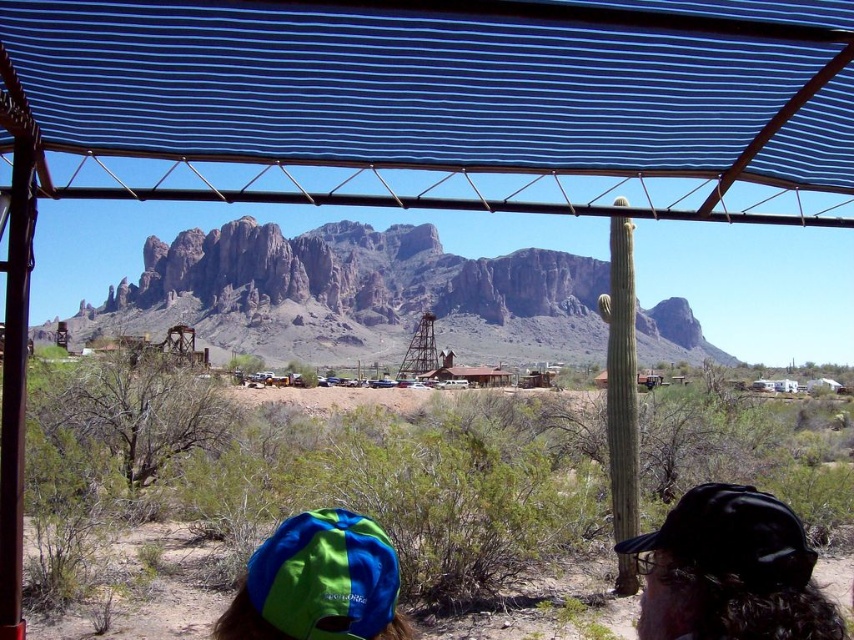
Can you confirm if rugged rock mountain at center is smaller than black matte baseball cap at lower right?

No, rugged rock mountain at center is not smaller than black matte baseball cap at lower right.

Which is behind, point (686, 346) or point (788, 525)?

Point (686, 346)

Identify the location of rugged rock mountain at center. (354, 294).

Is blue striped canopy at upper center positioned in front of black matte baseball cap at lower right?

No.

Measure the distance between point (816, 68) and camera.

They are 59.91 meters apart.

This screenshot has height=640, width=854. What are the coordinates of `blue striped canopy at upper center` in the screenshot? It's located at (443, 96).

The image size is (854, 640). What do you see at coordinates (443, 96) in the screenshot?
I see `blue striped canopy at upper center` at bounding box center [443, 96].

Is blue striped canopy at upper center positioned behind rugged rock mountain at center?

No.

Where is `blue striped canopy at upper center`? blue striped canopy at upper center is located at coordinates (443, 96).